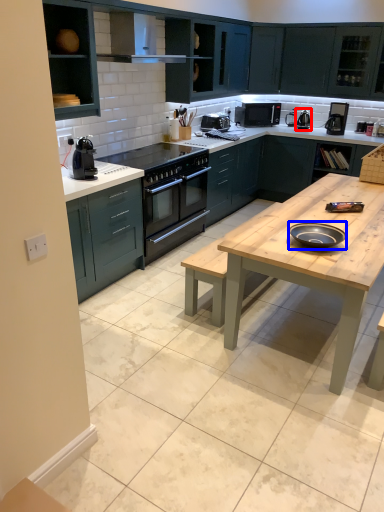
Question: Among these objects, which one is nearest to the camera, appliance (highlighted by a red box) or pizza pan (highlighted by a blue box)?

Choices:
 (A) appliance
 (B) pizza pan

Answer: (B)